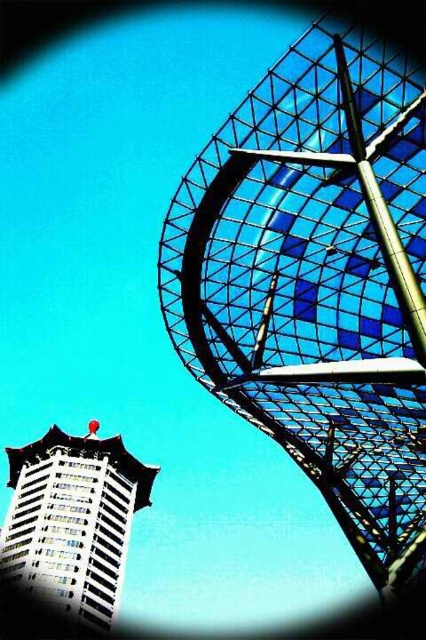
Between point (419, 132) and point (109, 612), which one is positioned in front?

Positioned in front is point (419, 132).

Who is more forward, (198,339) or (14,536)?

Point (198,339)

Locate an element on the screen. The height and width of the screenshot is (640, 426). transparent glass tower at upper right is located at coordinates (319, 285).